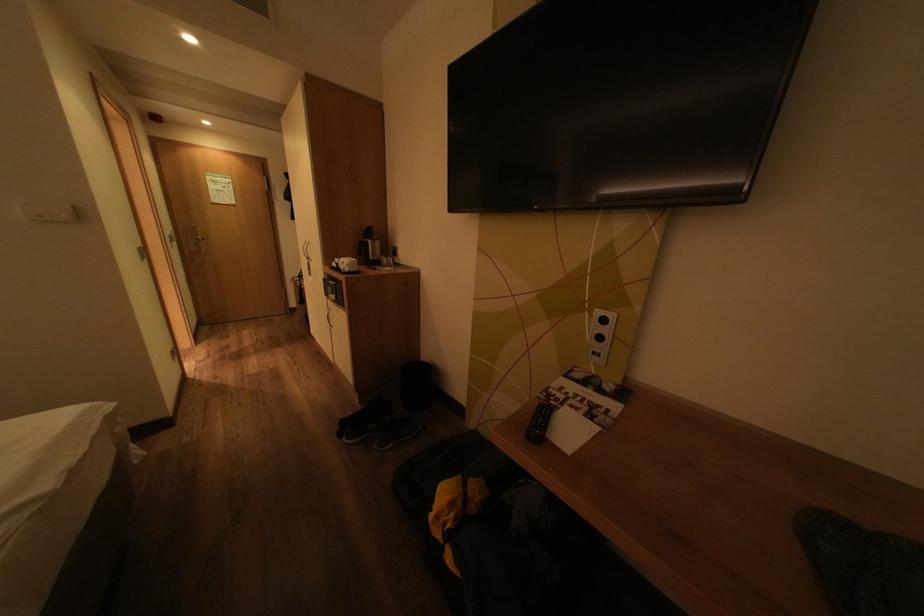
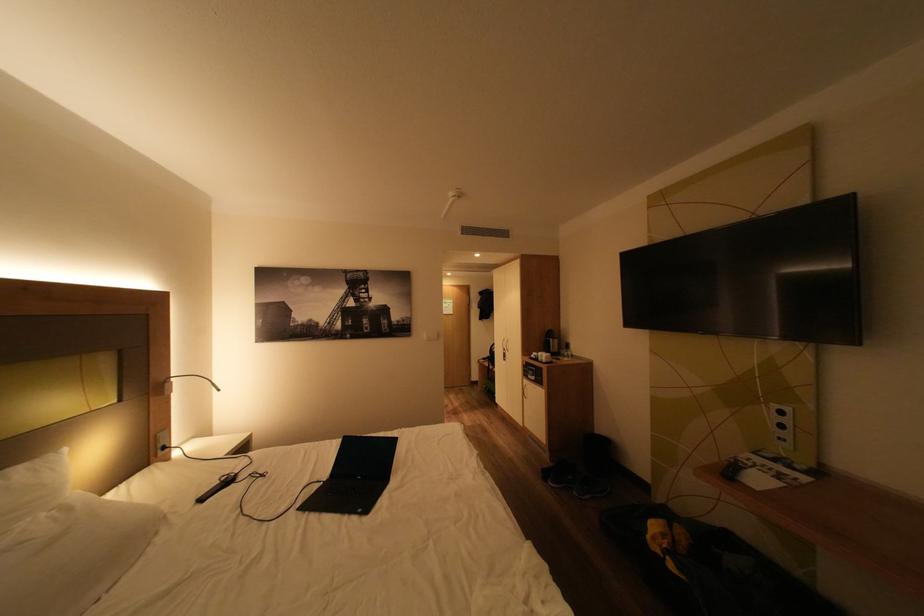
Find the pixel in the second image that matches point 353,260 in the first image.

(551, 354)